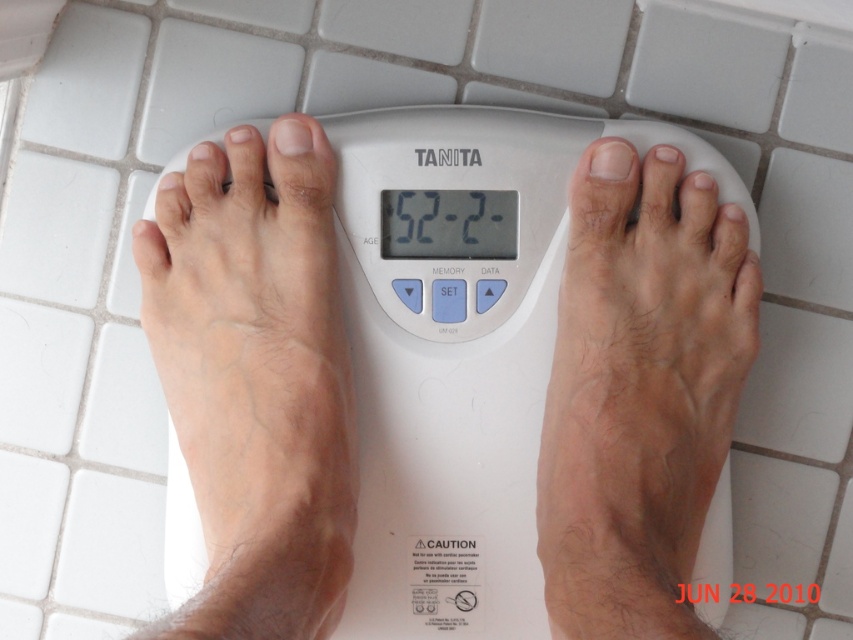
How far apart are pale skin at center and light skin textured foot at center?

pale skin at center and light skin textured foot at center are 8.86 inches apart.

Between pale skin at center and light skin textured foot at center, which one appears on the right side from the viewer's perspective?

light skin textured foot at center

The width and height of the screenshot is (853, 640). Find the location of `pale skin at center`. pale skin at center is located at coordinates (254, 380).

Is white plastic scale at center wider than pale skin at center?

Correct, the width of white plastic scale at center exceeds that of pale skin at center.

Can you confirm if white plastic scale at center is taller than pale skin at center?

Correct, white plastic scale at center is much taller as pale skin at center.

Where is `white plastic scale at center`? white plastic scale at center is located at coordinates (461, 362).

Locate an element on the screen. This screenshot has height=640, width=853. white plastic scale at center is located at coordinates (461, 362).

Does light skin textured foot at center have a greater height compared to black plastic thermometer at center?

Yes, light skin textured foot at center is taller than black plastic thermometer at center.

Does point (703, 499) lie behind point (459, 205)?

That is False.

Between point (619, 588) and point (428, 227), which one is positioned behind?

Positioned behind is point (428, 227).

I want to click on light skin textured foot at center, so click(x=640, y=392).